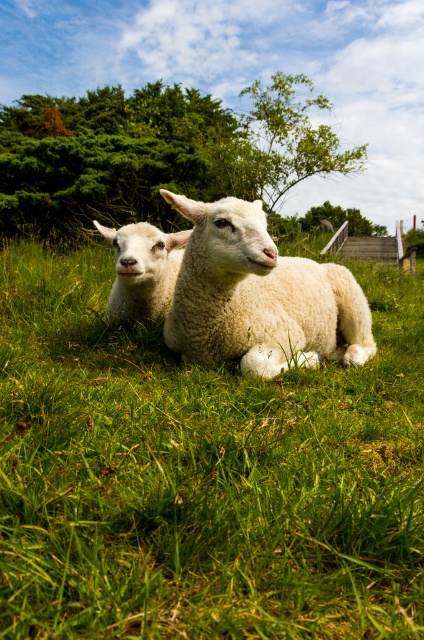
You are a photographer trying to capture the white woolen sheep at center in your shot. Since the green soft grass at center is blocking the view, can you determine if you need to move closer or farther away to get a clear view of the sheep?

The green soft grass at center is taller than the white woolen sheep at center, so moving closer to the sheep would lower the grass in the foreground, potentially reducing the obstruction. Alternatively, moving farther away might increase the relative size of the sheep compared to the grass, but since the grass is taller, getting closer would likely provide a clearer view by minimizing the grass blocking the front.